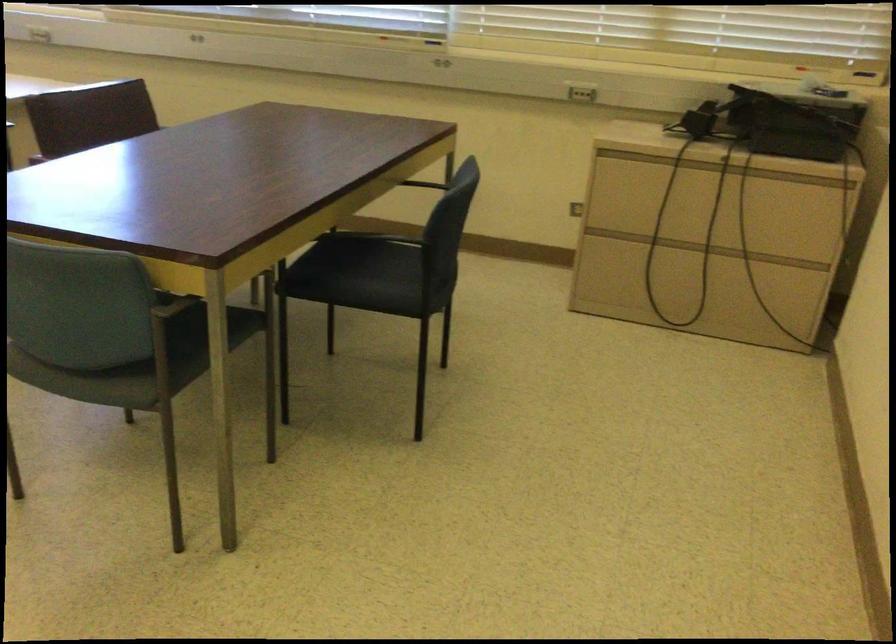
Where is `green chair armrest`? The image size is (896, 644). green chair armrest is located at coordinates (170, 303).